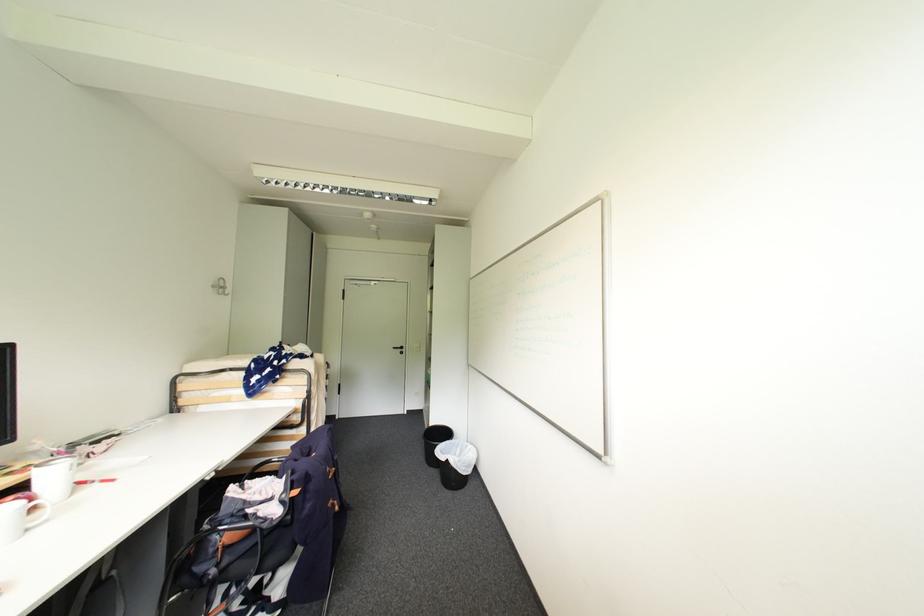
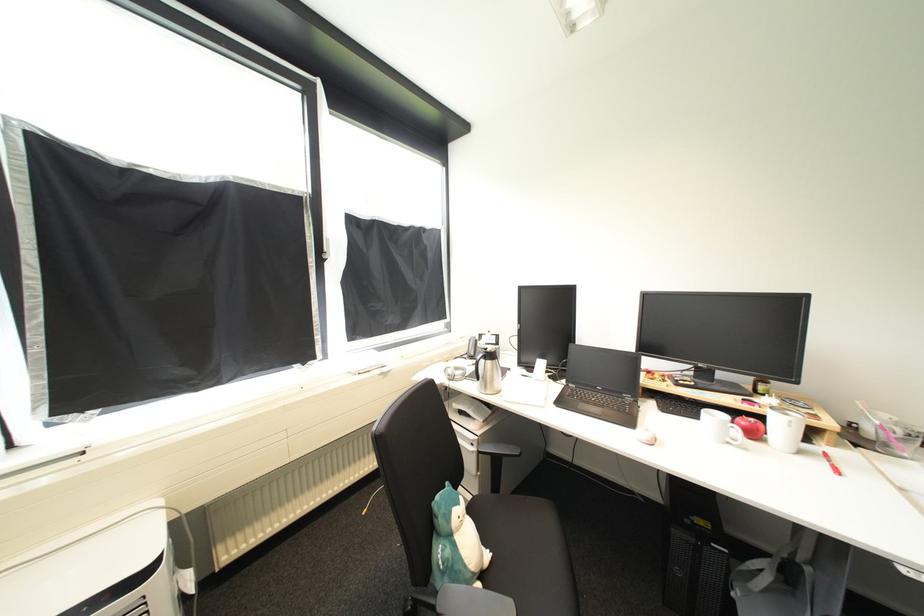
In the second image, find the point that corresponds to (103,484) in the first image.

(834, 464)